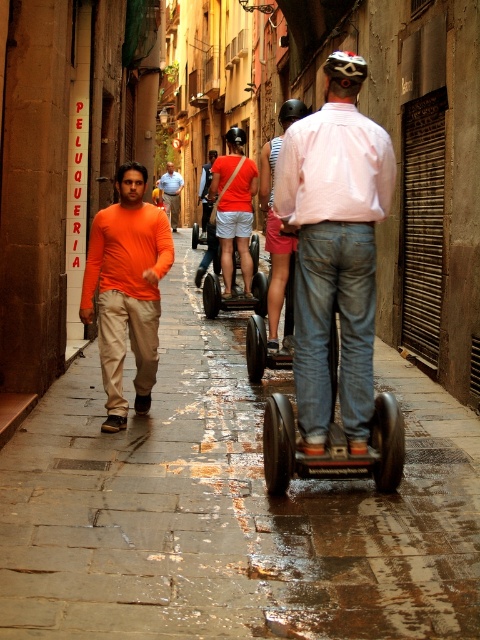
Question: Among these points, which one is farthest from the camera?

Choices:
 (A) (383, 406)
 (B) (207, 164)
 (C) (261, 321)

Answer: (B)

Question: Can you confirm if orange matte shirt at left is positioned to the right of rubberized black scooter at center?

Choices:
 (A) no
 (B) yes

Answer: (A)

Question: Which point is farther from the camera taking this photo?

Choices:
 (A) (112, 404)
 (B) (289, 248)
 (C) (256, 308)
 (D) (296, 342)

Answer: (C)

Question: Which point is closer to the camera?

Choices:
 (A) orange matte shirt at center
 (B) rubberized black scooter at center
 (C) pink fabric shirt at center

Answer: (C)

Question: Is wet stone pavement at center in front of rubberized black scooter at center?

Choices:
 (A) yes
 (B) no

Answer: (A)

Question: Is pink fabric shorts at center smaller than orange cotton shirt at center?

Choices:
 (A) no
 (B) yes

Answer: (B)